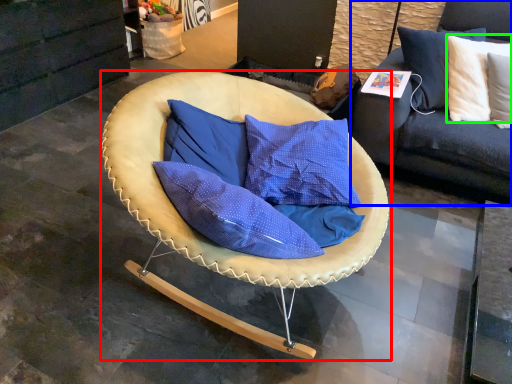
Question: Which object is positioned closest to chair (highlighted by a red box)? Select from studio couch (highlighted by a blue box) and pillow (highlighted by a green box).

Choices:
 (A) studio couch
 (B) pillow

Answer: (A)